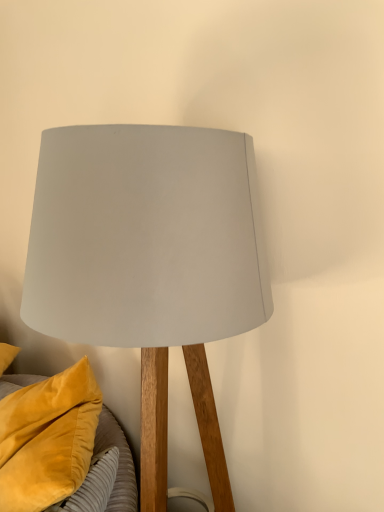
Question: From their relative heights in the image, would you say matte gray lampshade at center is taller or shorter than velvet yellow pillow at lower left?

Choices:
 (A) short
 (B) tall

Answer: (B)

Question: In the image, is matte gray lampshade at center positioned in front of or behind velvet yellow pillow at lower left?

Choices:
 (A) front
 (B) behind

Answer: (A)

Question: From the image's perspective, is matte gray lampshade at center positioned above or below velvet yellow pillow at lower left?

Choices:
 (A) above
 (B) below

Answer: (A)

Question: Considering the positions of velvet yellow pillow at lower left and matte gray lampshade at center in the image, is velvet yellow pillow at lower left wider or thinner than matte gray lampshade at center?

Choices:
 (A) wide
 (B) thin

Answer: (B)

Question: From a real-world perspective, is velvet yellow pillow at lower left physically located above or below matte gray lampshade at center?

Choices:
 (A) above
 (B) below

Answer: (B)

Question: Visually, is velvet yellow pillow at lower left positioned to the left or to the right of matte gray lampshade at center?

Choices:
 (A) right
 (B) left

Answer: (B)

Question: Based on their sizes in the image, would you say velvet yellow pillow at lower left is bigger or smaller than matte gray lampshade at center?

Choices:
 (A) big
 (B) small

Answer: (B)